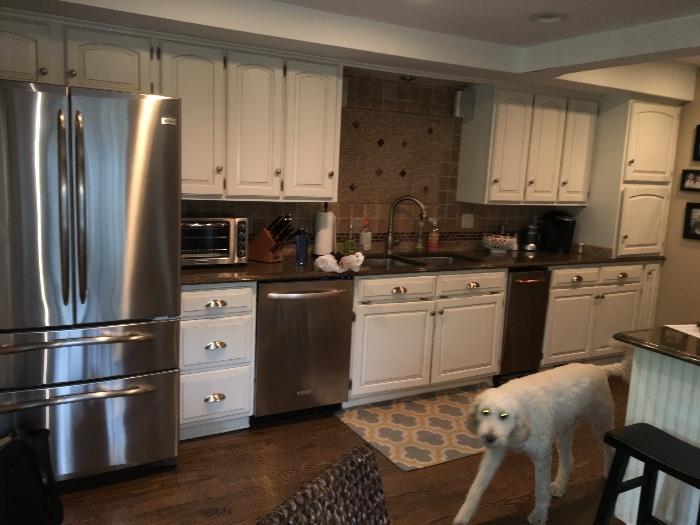
Where is `knife block`? The height and width of the screenshot is (525, 700). knife block is located at coordinates (266, 250).